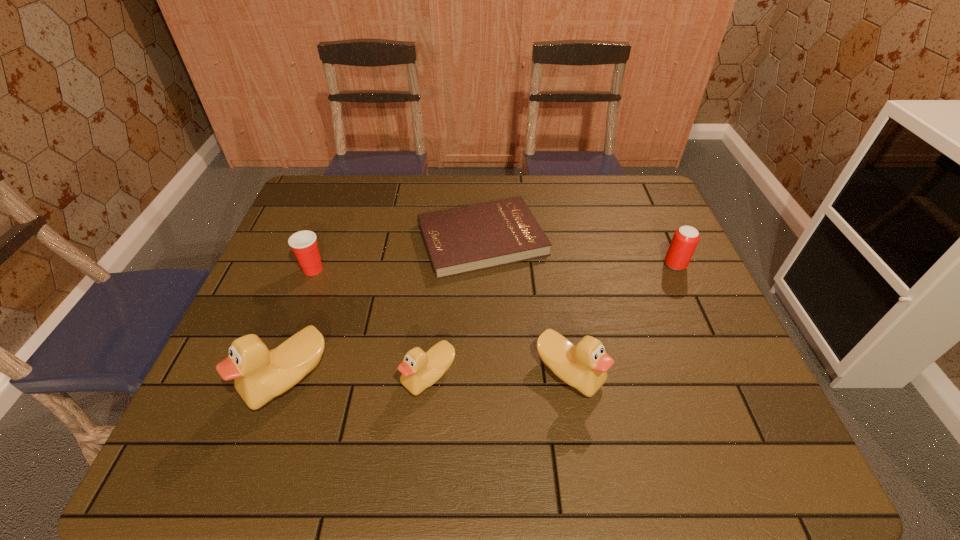
All ducks are currently evenly spaced. To continue this pattern, where would you add another duck on the right? Please point out a vacant spot. Please provide its 2D coordinates. Your answer should be formatted as a tuple, i.e. [(x, y)], where the tuple contains the x and y coordinates of a point satisfying the conditions above.

[(708, 369)]